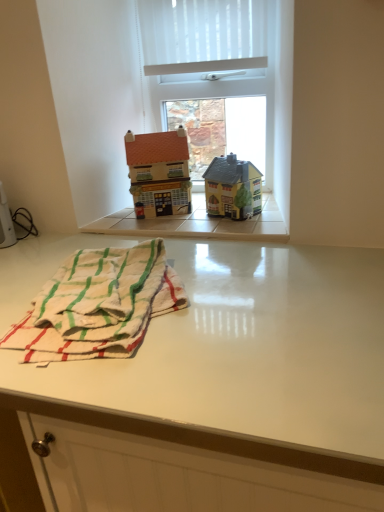
Question: Is white woven beach towel at lower left situated inside white glossy table at lower center or outside?

Choices:
 (A) outside
 (B) inside

Answer: (A)

Question: Looking at the image, does white woven beach towel at lower left seem bigger or smaller compared to white glossy table at lower center?

Choices:
 (A) big
 (B) small

Answer: (B)

Question: Which object is positioned closest to the yellow matte house at center, the 1th toy from the right?

Choices:
 (A) matte brown house at center, marked as the 2th toy in a right-to-left arrangement
 (B) white glossy table at lower center
 (C) white plastic window at upper center
 (D) white woven beach towel at lower left

Answer: (A)

Question: Which of these objects is positioned closest to the yellow matte house at center, the 1th toy from the right?

Choices:
 (A) white glossy table at lower center
 (B) white plastic window at upper center
 (C) white woven beach towel at lower left
 (D) matte brown house at center, placed as the 1th toy when sorted from left to right

Answer: (D)